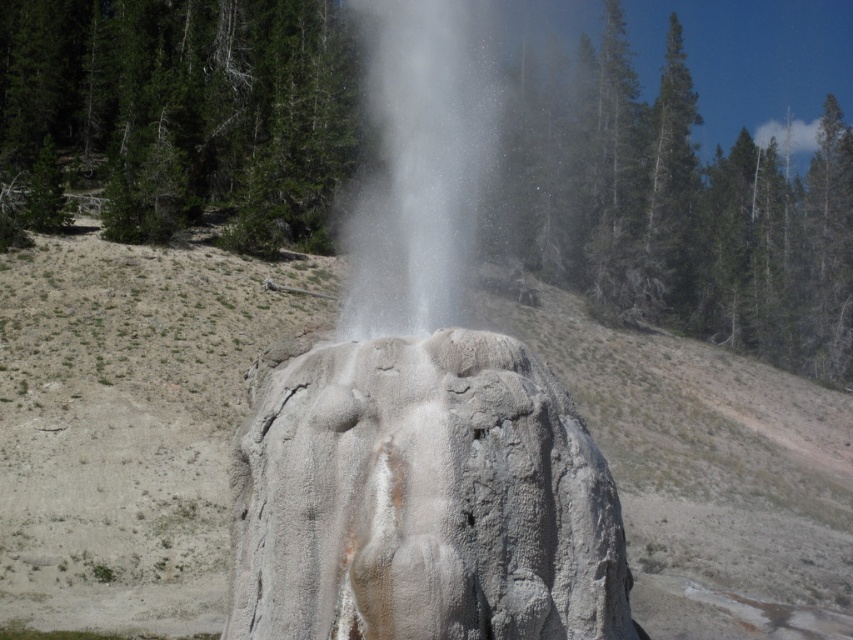
Which of these two, white textured rock at center or gray textured rock at center, stands shorter?

gray textured rock at center is shorter.

Does white textured rock at center have a greater height compared to gray textured rock at center?

Correct, white textured rock at center is much taller as gray textured rock at center.

Describe the element at coordinates (421, 413) in the screenshot. The width and height of the screenshot is (853, 640). I see `white textured rock at center` at that location.

In order to click on white textured rock at center in this screenshot , I will do `click(421, 413)`.

How much distance is there between white textured rock at center and white vapor at center?

white textured rock at center is 77.94 centimeters away from white vapor at center.

You are a GUI agent. You are given a task and a screenshot of the screen. Output one action in this format:
    pyautogui.click(x=<x>, y=<y>)
    Task: Click on the white textured rock at center
    
    Given the screenshot: What is the action you would take?
    pyautogui.click(x=421, y=413)

Identify the location of white textured rock at center. (421, 413).

Between gray rock formation at center and gray textured rock at center, which one has less height?

Standing shorter between the two is gray textured rock at center.

Does gray rock formation at center appear over gray textured rock at center?

Yes.

The image size is (853, 640). I want to click on gray rock formation at center, so click(x=126, y=424).